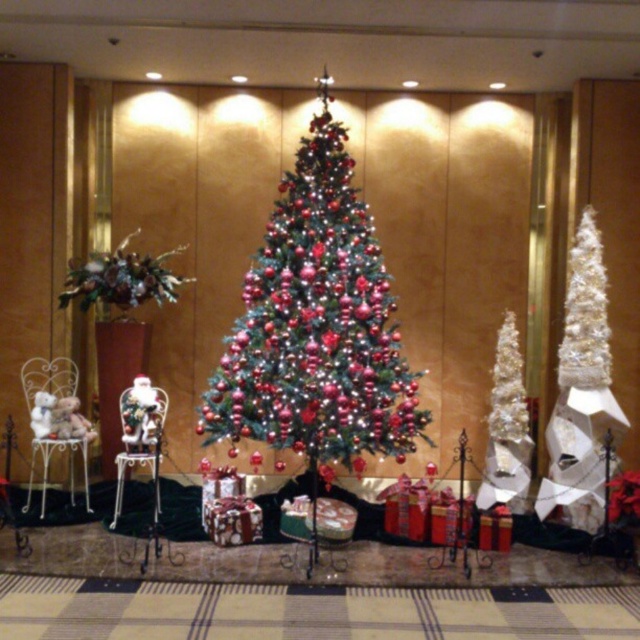
You are standing in front of the Christmas display and want to take a photo of both the white metallic chair at left and the white glittery christmas tree at right. Which object will appear larger in your photo?

The white metallic chair at left will appear larger in your photo because it is closer to the viewer than the white glittery christmas tree at right.

You are standing in front of the Christmas tree and want to place a gift under it. The gift requires a space of 15 feet to be placed safely. Is the distance between you and the white metal chair at left sufficient to move the gift without obstruction?

The distance between you and the white metal chair at left is 14.74 feet, which is slightly less than the required 15 feet. Therefore, the space may be insufficient to move the gift safely without obstruction.